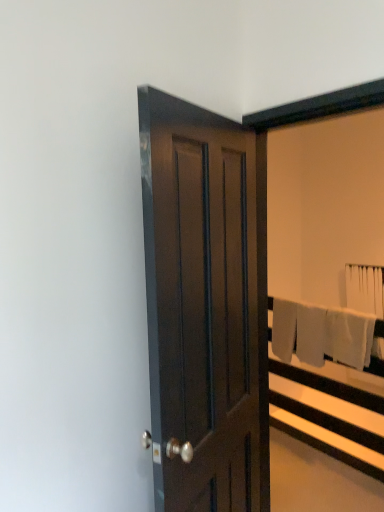
This screenshot has height=512, width=384. Find the location of `white fabric bed frame at right`. white fabric bed frame at right is located at coordinates (332, 413).

What do you see at coordinates (206, 303) in the screenshot?
I see `dark wood door at center` at bounding box center [206, 303].

Measure the distance between point [377,371] and camera.

The depth of point [377,371] is 8.69 feet.

Where is `white fabric bed frame at right`? The height and width of the screenshot is (512, 384). white fabric bed frame at right is located at coordinates (332, 413).

Where is `door above the white cotton bath towel at right, positioned as the 1th bath towel in bottom-to-top order (from the image's perspective)`? This screenshot has height=512, width=384. door above the white cotton bath towel at right, positioned as the 1th bath towel in bottom-to-top order (from the image's perspective) is located at coordinates (206, 303).

Which object is closer to the camera, dark wood door at center or white cotton bath towel at right, which is the 1th bath towel from left to right?

dark wood door at center is more forward.

Considering the relative sizes of dark wood door at center and white cotton bath towel at right, marked as the 2th bath towel in a top-to-bottom arrangement, in the image provided, is dark wood door at center smaller than white cotton bath towel at right, marked as the 2th bath towel in a top-to-bottom arrangement,?

No, dark wood door at center is not smaller than white cotton bath towel at right, marked as the 2th bath towel in a top-to-bottom arrangement.

Looking at their sizes, would you say dark wood door at center is wider or thinner than white fabric bath towel at upper right, the 1th bath towel when ordered from right to left?

dark wood door at center is wider than white fabric bath towel at upper right, the 1th bath towel when ordered from right to left.

From a real-world perspective, is dark wood door at center beneath white fabric bath towel at upper right, arranged as the 2th bath towel when viewed from the front?

No, from a real-world perspective, dark wood door at center is not under white fabric bath towel at upper right, arranged as the 2th bath towel when viewed from the front.

What's the angular difference between dark wood door at center and white fabric bath towel at upper right, the second bath towel when ordered from bottom to top,'s facing directions?

The angular difference between dark wood door at center and white fabric bath towel at upper right, the second bath towel when ordered from bottom to top, is 112 degrees.

Is white fabric bath towel at upper right, the second bath towel when ordered from bottom to top, at the left side of white cotton bath towel at right, acting as the 2th bath towel starting from the right?

Incorrect, white fabric bath towel at upper right, the second bath towel when ordered from bottom to top, is not on the left side of white cotton bath towel at right, acting as the 2th bath towel starting from the right.

Would you say white fabric bath towel at upper right, acting as the first bath towel starting from the back, contains white cotton bath towel at right, marked as the 2th bath towel in a top-to-bottom arrangement?

No, white cotton bath towel at right, marked as the 2th bath towel in a top-to-bottom arrangement, is not surrounded by white fabric bath towel at upper right, acting as the first bath towel starting from the back.

Which is in front, white fabric bath towel at upper right, acting as the first bath towel starting from the back, or white cotton bath towel at right, the first bath towel when ordered from front to back?

Positioned in front is white cotton bath towel at right, the first bath towel when ordered from front to back.

Does point (370, 276) come closer to viewer compared to point (372, 346)?

That is False.

Considering the relative sizes of white fabric bed frame at right and white cotton bath towel at right, marked as the 2th bath towel in a top-to-bottom arrangement, in the image provided, is white fabric bed frame at right thinner than white cotton bath towel at right, marked as the 2th bath towel in a top-to-bottom arrangement,?

In fact, white fabric bed frame at right might be wider than white cotton bath towel at right, marked as the 2th bath towel in a top-to-bottom arrangement.

Who is smaller, white fabric bed frame at right or white cotton bath towel at right, marked as the 2th bath towel in a top-to-bottom arrangement?

With smaller size is white cotton bath towel at right, marked as the 2th bath towel in a top-to-bottom arrangement.

Based on the photo, could white cotton bath towel at right, which is the 1th bath towel from left to right, be considered to be inside white fabric bed frame at right?

Yes, white cotton bath towel at right, which is the 1th bath towel from left to right, is surrounded by white fabric bed frame at right.

Is white fabric bed frame at right looking in the opposite direction of white cotton bath towel at right, acting as the 2th bath towel starting from the right?

Absolutely, white fabric bed frame at right is directed away from white cotton bath towel at right, acting as the 2th bath towel starting from the right.

Is white fabric bath towel at upper right, arranged as the 2th bath towel when viewed from the front, in contact with dark wood door at center?

No, white fabric bath towel at upper right, arranged as the 2th bath towel when viewed from the front, is not beside dark wood door at center.

Is white fabric bath towel at upper right, the second bath towel when ordered from bottom to top, not within dark wood door at center?

white fabric bath towel at upper right, the second bath towel when ordered from bottom to top, is positioned outside dark wood door at center.

Which object is further away from the camera, white fabric bath towel at upper right, the 1th bath towel when ordered from right to left, or dark wood door at center?

Positioned behind is white fabric bath towel at upper right, the 1th bath towel when ordered from right to left.

The image size is (384, 512). I want to click on the 1st bath towel positioned below the dark wood door at center (from a real-world perspective), so click(365, 288).

You are a GUI agent. You are given a task and a screenshot of the screen. Output one action in this format:
    pyautogui.click(x=<x>, y=<y>)
    Task: Click on the bed frame below the white cotton bath towel at right, which is the 1th bath towel from left to right (from the image's perspective)
    This screenshot has height=512, width=384.
    Given the screenshot: What is the action you would take?
    pyautogui.click(x=332, y=413)

Considering the positions of point (376, 350) and point (359, 468), is point (376, 350) closer or farther from the camera than point (359, 468)?

Point (376, 350).

In the scene shown: Considering the relative sizes of white cotton bath towel at right, positioned as the 1th bath towel in bottom-to-top order, and white fabric bed frame at right in the image provided, is white cotton bath towel at right, positioned as the 1th bath towel in bottom-to-top order, shorter than white fabric bed frame at right?

Yes, white cotton bath towel at right, positioned as the 1th bath towel in bottom-to-top order, is shorter than white fabric bed frame at right.

Is white cotton bath towel at right, the first bath towel when ordered from front to back, turned away from white fabric bed frame at right?

Yes, white fabric bed frame at right is at the back of white cotton bath towel at right, the first bath towel when ordered from front to back.

Is white cotton bath towel at right, which is the second bath towel in back-to-front order, not close to white fabric bath towel at upper right, the 1th bath towel when ordered from right to left?

white cotton bath towel at right, which is the second bath towel in back-to-front order, is actually quite close to white fabric bath towel at upper right, the 1th bath towel when ordered from right to left.

Where is `bath towel on the right of white cotton bath towel at right, which is the second bath towel in back-to-front order`? This screenshot has width=384, height=512. bath towel on the right of white cotton bath towel at right, which is the second bath towel in back-to-front order is located at coordinates (365, 288).

From the picture: Which is closer to the camera, (325, 355) or (375, 313)?

Positioned in front is point (325, 355).

Does white cotton bath towel at right, which is the second bath towel in back-to-front order, have a larger size compared to white fabric bath towel at upper right, which appears as the second bath towel when viewed from the left?

Yes, white cotton bath towel at right, which is the second bath towel in back-to-front order, is bigger than white fabric bath towel at upper right, which appears as the second bath towel when viewed from the left.

At what (x,y) coordinates should I click in order to perform the action: click on bath towel below the dark wood door at center (from the image's perspective). Please return your answer as a coordinate pair (x, y). Looking at the image, I should click on (377, 351).

From the dark wood door at center, count 2nd bath towels backward and point to it. Please provide its 2D coordinates.

[(365, 288)]

Based on the photo, estimate the real-world distances between objects in this image. Which object is closer to white cotton bath towel at right, positioned as the 1th bath towel in bottom-to-top order, white fabric bed frame at right or dark wood door at center?

white fabric bed frame at right lies closer to white cotton bath towel at right, positioned as the 1th bath towel in bottom-to-top order, than the other object.

Looking at this image, looking at the image, which one is located further to white cotton bath towel at right, marked as the 2th bath towel in a top-to-bottom arrangement, white fabric bath towel at upper right, acting as the first bath towel starting from the back, or dark wood door at center?

dark wood door at center is positioned further to the anchor white cotton bath towel at right, marked as the 2th bath towel in a top-to-bottom arrangement.

Considering their positions, is white cotton bath towel at right, which is the 1th bath towel from left to right, positioned further to dark wood door at center than white fabric bed frame at right?

white cotton bath towel at right, which is the 1th bath towel from left to right.

Which object lies nearer to the anchor point white fabric bed frame at right, dark wood door at center or white cotton bath towel at right, which is the 1th bath towel from left to right?

white cotton bath towel at right, which is the 1th bath towel from left to right, is closer to white fabric bed frame at right.

Based on their spatial positions, is white fabric bed frame at right or white cotton bath towel at right, marked as the 2th bath towel in a top-to-bottom arrangement, further from white fabric bath towel at upper right, acting as the first bath towel starting from the back?

Based on the image, white fabric bed frame at right appears to be further to white fabric bath towel at upper right, acting as the first bath towel starting from the back.

From the image, which object appears to be nearer to dark wood door at center, white fabric bed frame at right or white cotton bath towel at right, the first bath towel when ordered from front to back?

white fabric bed frame at right is closer to dark wood door at center.

Based on their spatial positions, is white cotton bath towel at right, positioned as the 1th bath towel in bottom-to-top order, or dark wood door at center further from white fabric bed frame at right?

Among the two, dark wood door at center is located further to white fabric bed frame at right.

Considering their positions, is white fabric bed frame at right positioned further to white fabric bath towel at upper right, which appears as the second bath towel when viewed from the left, than dark wood door at center?

The object further to white fabric bath towel at upper right, which appears as the second bath towel when viewed from the left, is dark wood door at center.

Find the location of `bed frame located between dark wood door at center and white fabric bath towel at upper right, acting as the first bath towel starting from the back, in the depth direction`. bed frame located between dark wood door at center and white fabric bath towel at upper right, acting as the first bath towel starting from the back, in the depth direction is located at coordinates (332, 413).

You are a GUI agent. You are given a task and a screenshot of the screen. Output one action in this format:
    pyautogui.click(x=<x>, y=<y>)
    Task: Click on the bath towel between white fabric bed frame at right and white fabric bath towel at upper right, arranged as the 2th bath towel when viewed from the front, in the front-back direction
    
    Given the screenshot: What is the action you would take?
    pyautogui.click(x=377, y=351)

You are a GUI agent. You are given a task and a screenshot of the screen. Output one action in this format:
    pyautogui.click(x=<x>, y=<y>)
    Task: Click on the bath towel located between dark wood door at center and white fabric bath towel at upper right, the second bath towel when ordered from bottom to top, in the depth direction
    This screenshot has height=512, width=384.
    Given the screenshot: What is the action you would take?
    pyautogui.click(x=377, y=351)

Find the location of a particular element. The width and height of the screenshot is (384, 512). bed frame located between dark wood door at center and white cotton bath towel at right, which is the second bath towel in back-to-front order, in the depth direction is located at coordinates (332, 413).